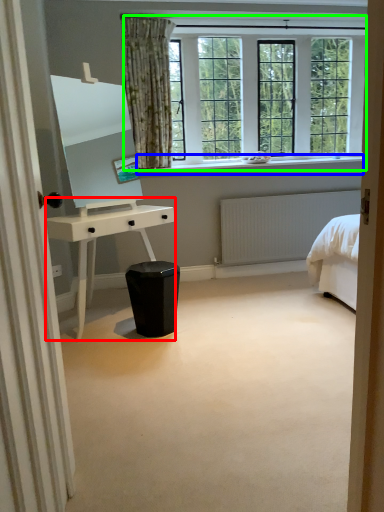
Question: Considering the real-world distances, which object is farthest from desk (highlighted by a red box)? window sill (highlighted by a blue box) or window (highlighted by a green box)?

Choices:
 (A) window sill
 (B) window

Answer: (B)